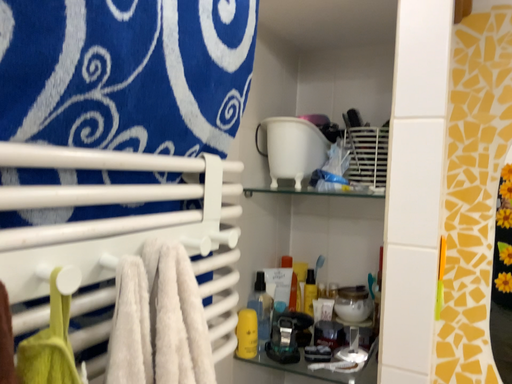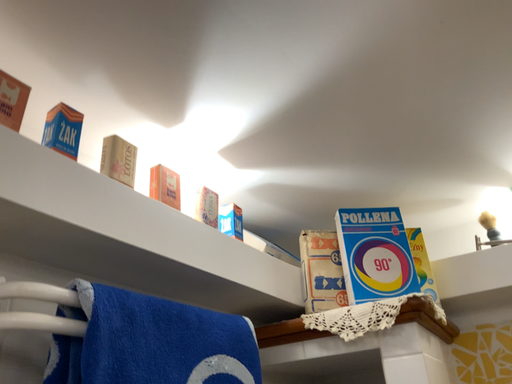
Question: How did the camera likely rotate when shooting the video?

Choices:
 (A) rotated downward
 (B) rotated upward

Answer: (B)